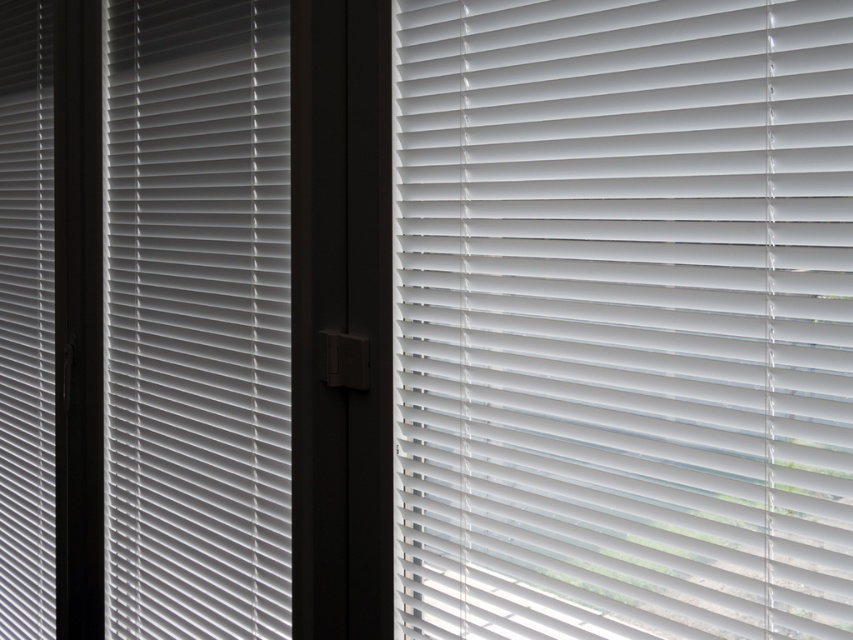
Question: Which point is farther from the camera taking this photo?

Choices:
 (A) (184, 483)
 (B) (790, 61)

Answer: (A)

Question: Does white plastic blinds at right have a larger size compared to white plastic blinds at left?

Choices:
 (A) no
 (B) yes

Answer: (A)

Question: In this image, where is white plastic blinds at right located relative to white plastic blinds at left?

Choices:
 (A) above
 (B) below

Answer: (B)

Question: Among these objects, which one is nearest to the camera?

Choices:
 (A) white plastic blinds at right
 (B) white plastic blinds at left

Answer: (A)

Question: Does white plastic blinds at right appear over white plastic blinds at left?

Choices:
 (A) yes
 (B) no

Answer: (B)